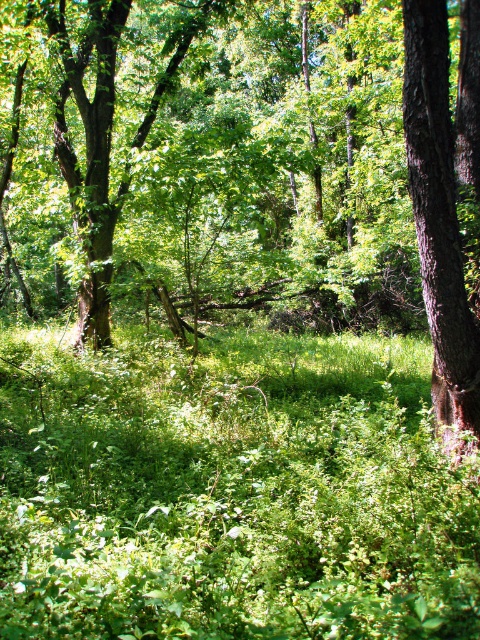
Can you confirm if green leafy tree at center is positioned to the left of green leafy grass at center?

Correct, you'll find green leafy tree at center to the left of green leafy grass at center.

At what (x,y) coordinates should I click in order to perform the action: click on green leafy tree at center. Please return your answer as a coordinate pair (x, y). Looking at the image, I should click on (238, 168).

Find the location of a particular element. green leafy tree at center is located at coordinates (238, 168).

Which is in front, point (204, 38) or point (436, 374)?

Positioned in front is point (436, 374).

Who is more forward, (29, 109) or (452, 330)?

Point (452, 330) is in front.

You are a GUI agent. You are given a task and a screenshot of the screen. Output one action in this format:
    pyautogui.click(x=<x>, y=<y>)
    Task: Click on the green leafy tree at center
    The height and width of the screenshot is (640, 480).
    Given the screenshot: What is the action you would take?
    pyautogui.click(x=238, y=168)

Does green leafy grass at center have a greater height compared to brown rough bark tree at right?

No, green leafy grass at center is not taller than brown rough bark tree at right.

Who is positioned more to the left, green leafy grass at center or brown rough bark tree at right?

green leafy grass at center

Locate an element on the screen. green leafy grass at center is located at coordinates (230, 490).

Locate an element on the screen. green leafy grass at center is located at coordinates (230, 490).